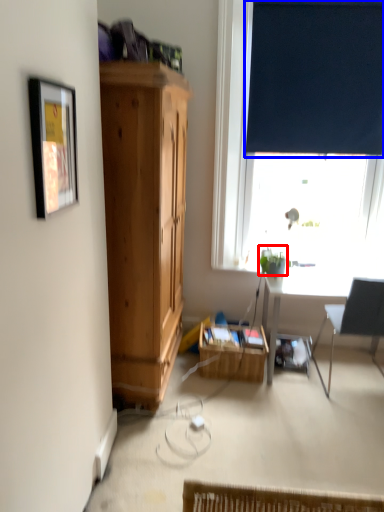
Question: Which object is closer to the camera taking this photo, plant (highlighted by a red box) or curtain (highlighted by a blue box)?

Choices:
 (A) plant
 (B) curtain

Answer: (A)